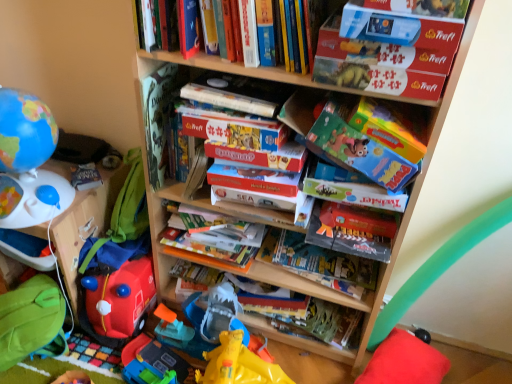
The image size is (512, 384). Describe the element at coordinates (85, 223) in the screenshot. I see `white plastic toy at left` at that location.

What do you see at coordinates (306, 315) in the screenshot? This screenshot has width=512, height=384. I see `hardcover book at center, placed as the 4th book when sorted from top to bottom` at bounding box center [306, 315].

Looking at this image, how much space does hardcover book at center, arranged as the first book when ordered from the bottom, occupy horizontally?

hardcover book at center, arranged as the first book when ordered from the bottom, is 7.71 inches wide.

How much space does hardcover book at upper center, positioned as the 2th paperback book in right-to-left order, occupy horizontally?

hardcover book at upper center, positioned as the 2th paperback book in right-to-left order, is 21.56 centimeters wide.

What is the approximate width of green fabric bean bag at lower left?

The width of green fabric bean bag at lower left is 10.77 inches.

The height and width of the screenshot is (384, 512). What do you see at coordinates (290, 33) in the screenshot? I see `hardcover book at upper center, which is the first book in top-to-bottom order` at bounding box center [290, 33].

The image size is (512, 384). What are the coordinates of `white plastic toy at left` in the screenshot? It's located at (85, 223).

From the picture: Which is farther, (360, 240) or (314, 311)?

The point (314, 311) is more distant.

Is matte cardboard book at center, which ranks as the second paperback book in left-to-right order, directly adjacent to hardcover book at center, arranged as the first book when ordered from the bottom?

No.

Can you confirm if matte cardboard book at center, which is counted as the first paperback book, starting from the bottom, is positioned to the right of hardcover book at center, arranged as the first book when ordered from the bottom?

Yes.

Is matte cardboard book at center, which ranks as the 1th paperback book in right-to-left order, completely or partially outside of hardcover book at center, placed as the 4th book when sorted from top to bottom?

Absolutely, matte cardboard book at center, which ranks as the 1th paperback book in right-to-left order, is external to hardcover book at center, placed as the 4th book when sorted from top to bottom.

Which object is more forward, hardcover book at upper center, positioned as the first paperback book in left-to-right order, or hardcover book at center, arranged as the first book when ordered from the bottom?

Positioned in front is hardcover book at upper center, positioned as the first paperback book in left-to-right order.

In terms of width, does hardcover book at upper center, the 1th paperback book when ordered from top to bottom, look wider or thinner when compared to hardcover book at center, placed as the 4th book when sorted from top to bottom?

In the image, hardcover book at upper center, the 1th paperback book when ordered from top to bottom, appears to be wider than hardcover book at center, placed as the 4th book when sorted from top to bottom.

Considering the relative positions of hardcover book at upper center, positioned as the 2th paperback book in right-to-left order, and hardcover book at center, arranged as the first book when ordered from the bottom, in the image provided, is hardcover book at upper center, positioned as the 2th paperback book in right-to-left order, to the left or to the right of hardcover book at center, arranged as the first book when ordered from the bottom,?

From the image, it's evident that hardcover book at upper center, positioned as the 2th paperback book in right-to-left order, is to the left of hardcover book at center, arranged as the first book when ordered from the bottom.

Considering the positions of point (52, 212) and point (334, 270), is point (52, 212) closer or farther from the camera than point (334, 270)?

Point (52, 212) is closer to the camera than point (334, 270).

Who is bigger, matte plastic globe at left, the second toy in the bottom-to-top sequence, or hardcover book at center, the 3th book positioned from the top?

matte plastic globe at left, the second toy in the bottom-to-top sequence, is bigger.

Is matte plastic globe at left, the first toy from the top, positioned far away from hardcover book at center, which appears as the 2th book when ordered from the bottom?

No, there isn't a large distance between matte plastic globe at left, the first toy from the top, and hardcover book at center, which appears as the 2th book when ordered from the bottom.

From the image's perspective, relative to hardcover book at center, which appears as the 2th book when ordered from the bottom, is matte plastic globe at left, the second toy in the bottom-to-top sequence, above or below?

matte plastic globe at left, the second toy in the bottom-to-top sequence, is situated higher than hardcover book at center, which appears as the 2th book when ordered from the bottom, in the image.

Can matte cardboard puzzle box at upper right, the third book positioned from the bottom, be found inside matte cardboard book at center, which is counted as the first paperback book, starting from the bottom?

No, matte cardboard puzzle box at upper right, the third book positioned from the bottom, is not inside matte cardboard book at center, which is counted as the first paperback book, starting from the bottom.

Considering the positions of objects matte cardboard book at center, which ranks as the second paperback book in left-to-right order, and matte cardboard puzzle box at upper right, the second book positioned from the top, in the image provided, who is more to the left, matte cardboard book at center, which ranks as the second paperback book in left-to-right order, or matte cardboard puzzle box at upper right, the second book positioned from the top,?

matte cardboard book at center, which ranks as the second paperback book in left-to-right order, is more to the left.

From a real-world perspective, is matte cardboard book at center, which ranks as the 2th paperback book in top-to-bottom order, physically above matte cardboard puzzle box at upper right, the second book positioned from the top?

No, from a real-world perspective, matte cardboard book at center, which ranks as the 2th paperback book in top-to-bottom order, is not over matte cardboard puzzle box at upper right, the second book positioned from the top

Based on the photo, considering the sizes of hardcover book at upper center, which is the fourth book from bottom to top, and green fabric bean bag at lower left in the image, is hardcover book at upper center, which is the fourth book from bottom to top, wider or thinner than green fabric bean bag at lower left?

hardcover book at upper center, which is the fourth book from bottom to top, is wider than green fabric bean bag at lower left.

From the image's perspective, is hardcover book at upper center, which is the first book in top-to-bottom order, over green fabric bean bag at lower left?

Indeed, from the image's perspective, hardcover book at upper center, which is the first book in top-to-bottom order, is shown above green fabric bean bag at lower left.

Is point (311, 49) closer or farther from the camera than point (26, 320)?

Clearly, point (311, 49) is closer to the camera than point (26, 320).

Could you tell me if hardcover book at upper center, which is the fourth book from bottom to top, is turned towards green fabric bean bag at lower left?

No, hardcover book at upper center, which is the fourth book from bottom to top, is not facing towards green fabric bean bag at lower left.

Is matte cardboard puzzle box at upper right, the third book positioned from the bottom, completely or partially outside of wooden bookcase at center?

No, matte cardboard puzzle box at upper right, the third book positioned from the bottom, is not outside of wooden bookcase at center.

Considering the sizes of objects matte cardboard puzzle box at upper right, the second book positioned from the top, and wooden bookcase at center in the image provided, who is thinner, matte cardboard puzzle box at upper right, the second book positioned from the top, or wooden bookcase at center?

matte cardboard puzzle box at upper right, the second book positioned from the top, is thinner.

Consider the image. Can you tell me how much matte cardboard puzzle box at upper right, the third book positioned from the bottom, and wooden bookcase at center differ in facing direction?

The angular difference between matte cardboard puzzle box at upper right, the third book positioned from the bottom, and wooden bookcase at center is 1.22 degrees.

Identify the location of the 1st book positioned above the wooden bookcase at center (from the image's perspective). point(379,65).

Which is behind, point (104, 288) or point (385, 73)?

Positioned behind is point (104, 288).

The height and width of the screenshot is (384, 512). Find the location of `the 2nd toy below when counting from the matte cardboard puzzle box at upper right, the second book positioned from the top (from the image's perspective)`. the 2nd toy below when counting from the matte cardboard puzzle box at upper right, the second book positioned from the top (from the image's perspective) is located at coordinates (117, 301).

Considering the relative sizes of rubberized red fire truck at lower left, which is counted as the 1th toy, starting from the bottom, and matte cardboard puzzle box at upper right, the third book positioned from the bottom, in the image provided, is rubberized red fire truck at lower left, which is counted as the 1th toy, starting from the bottom, wider than matte cardboard puzzle box at upper right, the third book positioned from the bottom,?

Yes.

In order to click on the 2nd book below the matte cardboard book at center, which ranks as the second paperback book in left-to-right order (from the image's perspective) in this screenshot , I will do `click(306, 315)`.

Locate an element on the screen. paperback book on the left of the hardcover book at center, placed as the 4th book when sorted from top to bottom is located at coordinates (238, 93).

Considering their positions, is hardcover book at center, arranged as the first book when ordered from the bottom, positioned closer to hardcover book at upper center, positioned as the first paperback book in left-to-right order, than hardcover book at upper center, which is the first book in top-to-bottom order?

hardcover book at upper center, which is the first book in top-to-bottom order.

Considering their positions, is hardcover book at upper center, which is the first book in top-to-bottom order, positioned closer to red plush pillow at lower right than hardcover book at center, the 3th book positioned from the top?

Among the two, hardcover book at center, the 3th book positioned from the top, is located nearer to red plush pillow at lower right.

Considering their positions, is hardcover book at center, which appears as the 2th book when ordered from the bottom, positioned closer to rubberized red fire truck at lower left, the second toy viewed from the top, than wooden bookcase at center?

wooden bookcase at center.

From the image, which object appears to be nearer to white plastic toy at left, hardcover book at upper center, which is the first book in top-to-bottom order, or green fabric bean bag at lower left?

green fabric bean bag at lower left lies closer to white plastic toy at left than the other object.

From the picture: Based on their spatial positions, is hardcover book at upper center, which is the first book in top-to-bottom order, or matte cardboard book at center, which is counted as the first paperback book, starting from the bottom, closer to red plush pillow at lower right?

Based on the image, matte cardboard book at center, which is counted as the first paperback book, starting from the bottom, appears to be nearer to red plush pillow at lower right.

Estimate the real-world distances between objects in this image. Which object is closer to matte cardboard book at center, which ranks as the 2th paperback book in top-to-bottom order, hardcover book at upper center, which is the first book in top-to-bottom order, or matte cardboard puzzle box at upper right, the third book positioned from the bottom?

The object closer to matte cardboard book at center, which ranks as the 2th paperback book in top-to-bottom order, is matte cardboard puzzle box at upper right, the third book positioned from the bottom.

Looking at the image, which one is located further to hardcover book at center, arranged as the first book when ordered from the bottom, hardcover book at center, the 3th book positioned from the top, or rubberized red fire truck at lower left, which is counted as the 1th toy, starting from the bottom?

rubberized red fire truck at lower left, which is counted as the 1th toy, starting from the bottom, lies further to hardcover book at center, arranged as the first book when ordered from the bottom, than the other object.

Looking at the image, which one is located closer to hardcover book at center, arranged as the first book when ordered from the bottom, matte plastic globe at left, the second toy in the bottom-to-top sequence, or matte cardboard puzzle box at upper right, the third book positioned from the bottom?

matte plastic globe at left, the second toy in the bottom-to-top sequence, is positioned closer to the anchor hardcover book at center, arranged as the first book when ordered from the bottom.

Where is `bookcase situated between hardcover book at upper center, the 1th paperback book when ordered from top to bottom, and matte cardboard puzzle box at upper right, the second book positioned from the top, from left to right`? The width and height of the screenshot is (512, 384). bookcase situated between hardcover book at upper center, the 1th paperback book when ordered from top to bottom, and matte cardboard puzzle box at upper right, the second book positioned from the top, from left to right is located at coordinates pyautogui.click(x=393, y=245).

This screenshot has width=512, height=384. What are the coordinates of `bookcase that lies between matte cardboard puzzle box at upper right, the second book positioned from the top, and red plush pillow at lower right from top to bottom` in the screenshot? It's located at [393, 245].

Find the location of a particular element. This screenshot has width=512, height=384. book between matte cardboard puzzle box at upper right, the third book positioned from the bottom, and hardcover book at center, arranged as the first book when ordered from the bottom, in the vertical direction is located at coordinates (319, 263).

Image resolution: width=512 pixels, height=384 pixels. In order to click on shelf between matte plastic globe at left, the first toy from the top, and hardcover book at upper center, which is the fourth book from bottom to top, in the horizontal direction in this screenshot , I will do (x=85, y=223).